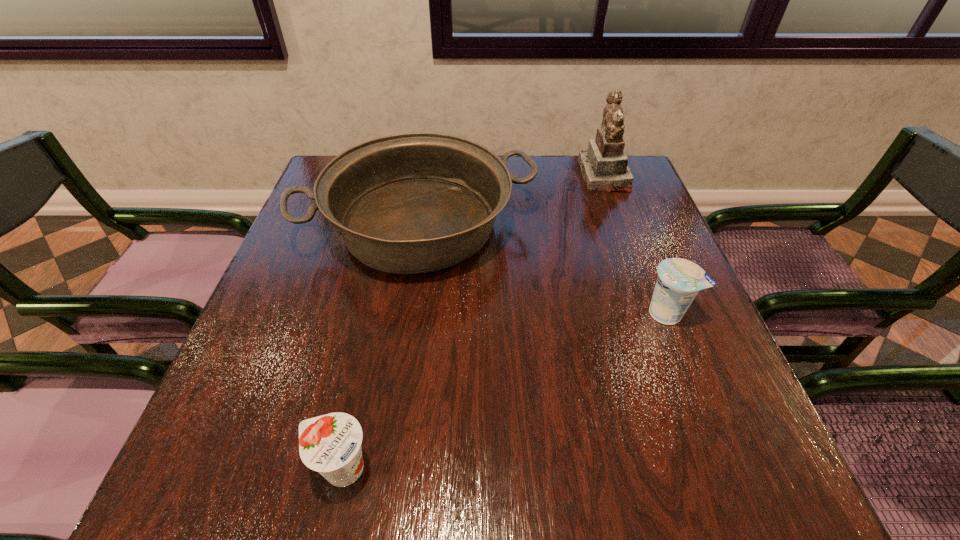
This screenshot has height=540, width=960. Identify the location of vacant space located on the left of the third farthest object. (570, 313).

The width and height of the screenshot is (960, 540). What are the coordinates of `free location located on the left of the nearest object` in the screenshot? It's located at (196, 468).

This screenshot has height=540, width=960. What are the coordinates of `figurine situated at the far edge` in the screenshot? It's located at (604, 166).

Image resolution: width=960 pixels, height=540 pixels. Find the location of `pan that is at the far edge`. pan that is at the far edge is located at coordinates (410, 203).

This screenshot has height=540, width=960. I want to click on object present at the near edge, so click(331, 444).

At what (x,y) coordinates should I click in order to perform the action: click on object that is at the left edge. Please return your answer as a coordinate pair (x, y). Looking at the image, I should click on (410, 203).

The width and height of the screenshot is (960, 540). I want to click on figurine located in the right edge section of the desktop, so click(604, 166).

Find the location of a particular element. The width and height of the screenshot is (960, 540). yogurt at the right edge is located at coordinates (679, 280).

At what (x,y) coordinates should I click in order to perform the action: click on object positioned at the far left corner. Please return your answer as a coordinate pair (x, y). Looking at the image, I should click on (410, 203).

You are a GUI agent. You are given a task and a screenshot of the screen. Output one action in this format:
    pyautogui.click(x=<x>, y=<y>)
    Task: Click on the object that is positioned at the far right corner
    The width and height of the screenshot is (960, 540).
    Given the screenshot: What is the action you would take?
    pyautogui.click(x=604, y=166)